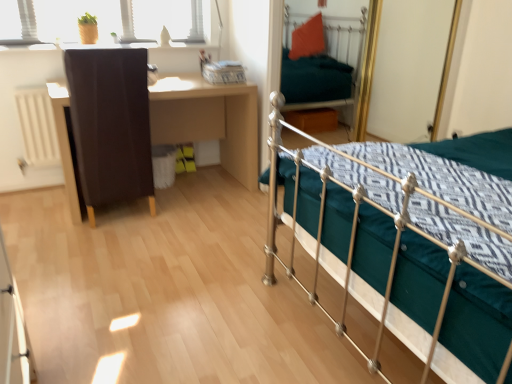
I want to click on free spot in front of matte brown cabinet at left, so click(100, 242).